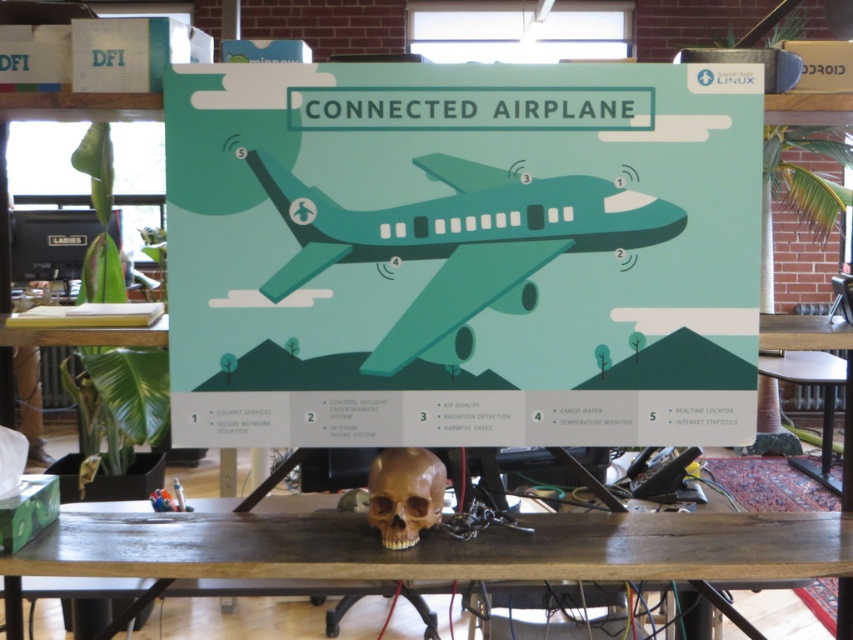
Which is more to the right, teal paper airplane at center or brown wood table at center?

teal paper airplane at center is more to the right.

Can you confirm if teal paper airplane at center is smaller than brown wood table at center?

Indeed, teal paper airplane at center has a smaller size compared to brown wood table at center.

What do you see at coordinates (462, 253) in the screenshot? I see `teal paper airplane at center` at bounding box center [462, 253].

Locate an element on the screen. teal paper airplane at center is located at coordinates (462, 253).

Is brown wood table at center closer to camera compared to brown matte skull at center?

Yes, brown wood table at center is closer to the viewer.

Is point (312, 548) more distant than point (425, 481)?

No, it is in front of (425, 481).

Between point (213, 516) and point (399, 449), which one is positioned in front?

Point (399, 449)

This screenshot has height=640, width=853. Find the location of `brown wood table at center`. brown wood table at center is located at coordinates (434, 548).

Does teal paper airplane at center appear on the left side of brown matte skull at center?

No, teal paper airplane at center is not to the left of brown matte skull at center.

Image resolution: width=853 pixels, height=640 pixels. What do you see at coordinates (462, 253) in the screenshot? I see `teal paper airplane at center` at bounding box center [462, 253].

Identify the location of teal paper airplane at center. The width and height of the screenshot is (853, 640). (462, 253).